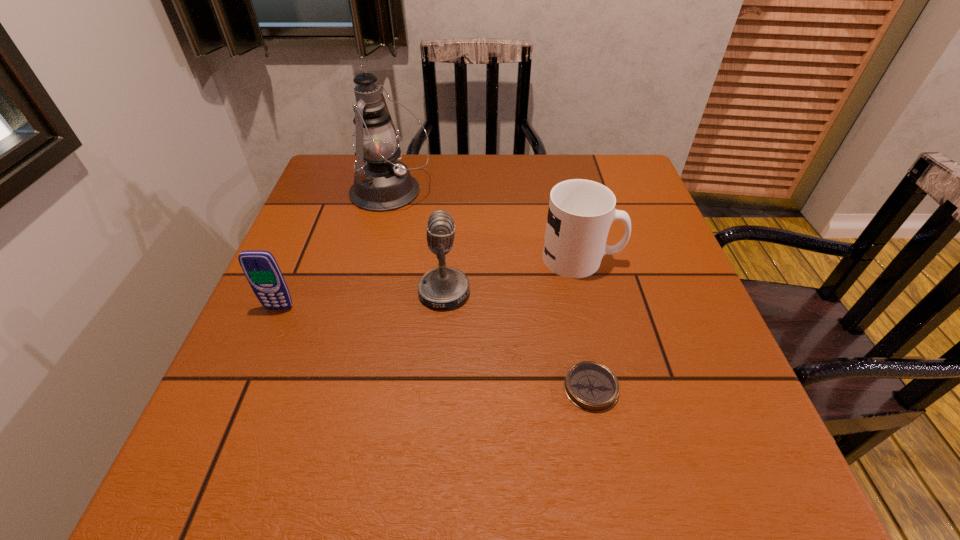
Identify the location of vacant space that is in between the microphone and the mug. This screenshot has height=540, width=960. pos(513,275).

Locate an element on the screen. This screenshot has width=960, height=540. unoccupied position between the microphone and the oil lamp is located at coordinates (418, 242).

This screenshot has height=540, width=960. In order to click on vacant area that lies between the compass and the tallest object in this screenshot , I will do `click(491, 290)`.

Identify which object is the closest to the mug. Please provide its 2D coordinates. Your answer should be formatted as a tuple, i.e. [(x, y)], where the tuple contains the x and y coordinates of a point satisfying the conditions above.

[(445, 287)]

Select which object is the second closest to the oil lamp. Please provide its 2D coordinates. Your answer should be formatted as a tuple, i.e. [(x, y)], where the tuple contains the x and y coordinates of a point satisfying the conditions above.

[(580, 214)]

Where is `free point that satisfies the following two spatial constraints: 1. on the front-facing side of the microphone; 2. on the front-facing side of the cellular telephone`? free point that satisfies the following two spatial constraints: 1. on the front-facing side of the microphone; 2. on the front-facing side of the cellular telephone is located at coordinates (443, 308).

Find the location of a particular element. The image size is (960, 540). free space in the image that satisfies the following two spatial constraints: 1. on the front-facing side of the microphone; 2. on the left side of the compass is located at coordinates (437, 388).

You are a GUI agent. You are given a task and a screenshot of the screen. Output one action in this format:
    pyautogui.click(x=<x>, y=<y>)
    Task: Click on the free space that satisfies the following two spatial constraints: 1. on the handle side of the mug; 2. on the front-facing side of the leftmost object
    
    Given the screenshot: What is the action you would take?
    pyautogui.click(x=593, y=308)

I want to click on free spot that satisfies the following two spatial constraints: 1. on the front-facing side of the cellular telephone; 2. on the left side of the shortest object, so click(x=245, y=388).